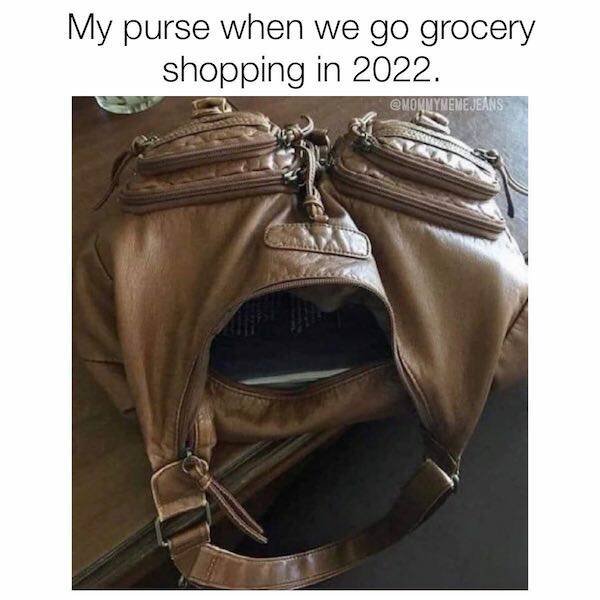
Identify the location of table. The width and height of the screenshot is (600, 600). (96, 146).